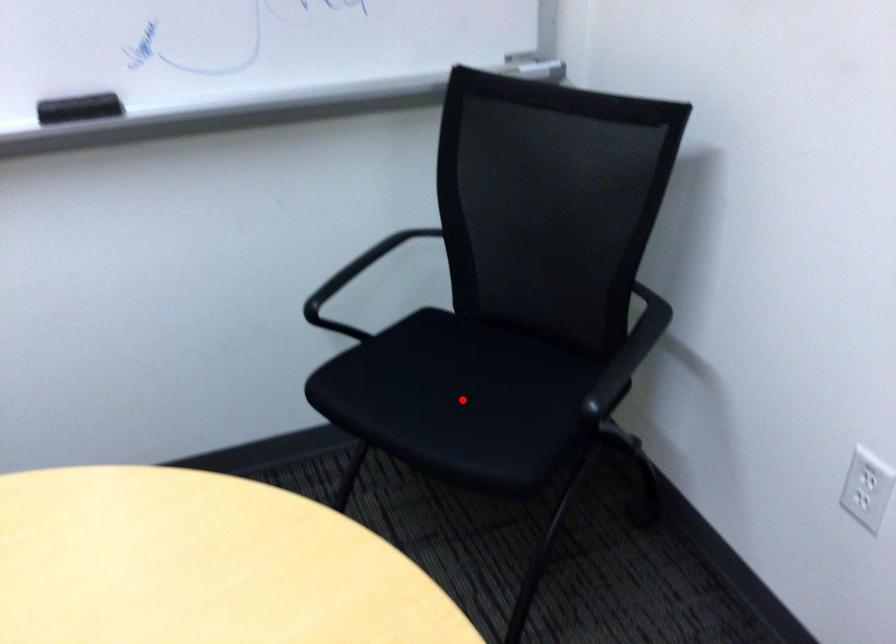
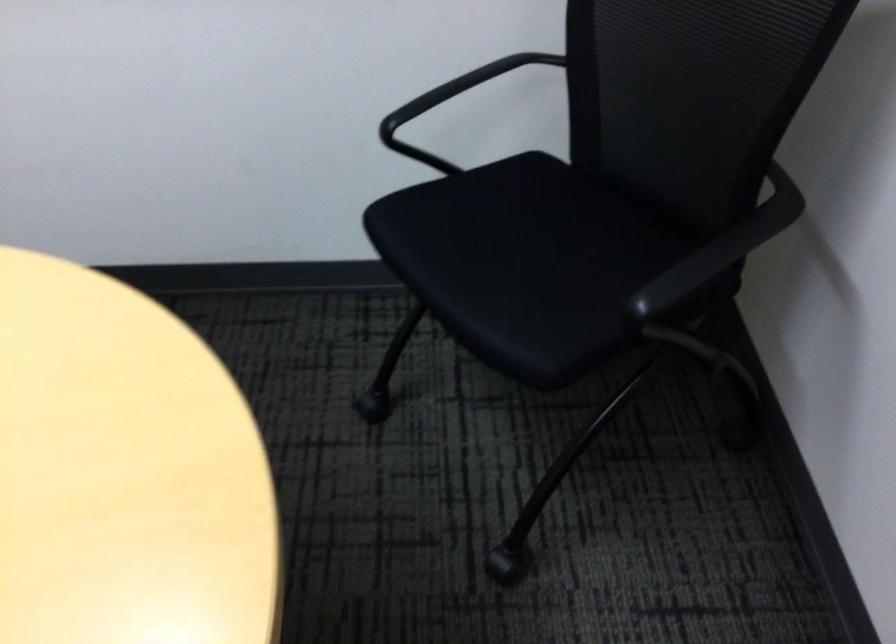
Question: I am providing you with two images of the same scene from different viewpoints. A red point is shown in image1. For the corresponding object point in image2, is it positioned nearer or farther from the camera?

Choices:
 (A) Nearer
 (B) Farther

Answer: (A)